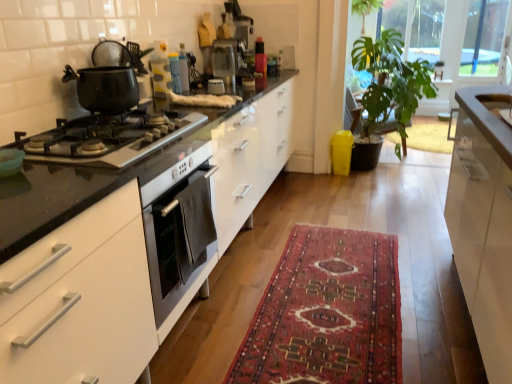
Question: Are white glossy cabinet at right and green leafy plant at upper right, the second window screen when ordered from right to left, beside each other?

Choices:
 (A) no
 (B) yes

Answer: (A)

Question: From a real-world perspective, is white glossy cabinet at right located beneath green leafy plant at upper right, the first window screen in the left-to-right sequence?

Choices:
 (A) yes
 (B) no

Answer: (A)

Question: Could you tell me if white glossy cabinet at right is turned towards green leafy plant at upper right, the first window screen in the left-to-right sequence?

Choices:
 (A) yes
 (B) no

Answer: (B)

Question: From the image's perspective, is white glossy cabinet at right on top of green leafy plant at upper right, the second window screen when ordered from right to left?

Choices:
 (A) yes
 (B) no

Answer: (B)

Question: Is white glossy cabinet at right facing away from green leafy plant at upper right, the first window screen in the left-to-right sequence?

Choices:
 (A) yes
 (B) no

Answer: (B)

Question: From the image's perspective, would you say white glossy cabinet at right is shown under green leafy plant at upper right, the first window screen in the left-to-right sequence?

Choices:
 (A) yes
 (B) no

Answer: (A)

Question: Considering the relative positions of white glossy sink at upper right and shiny black gas stove at left, the second gas stove when ordered from bottom to top, in the image provided, is white glossy sink at upper right to the left of shiny black gas stove at left, the second gas stove when ordered from bottom to top, from the viewer's perspective?

Choices:
 (A) yes
 (B) no

Answer: (B)

Question: From the image's perspective, is white glossy sink at upper right over shiny black gas stove at left, the second gas stove when ordered from bottom to top?

Choices:
 (A) yes
 (B) no

Answer: (A)

Question: Considering the relative positions of white glossy sink at upper right and shiny black gas stove at left, the 1th gas stove positioned from the top, in the image provided, is white glossy sink at upper right behind shiny black gas stove at left, the 1th gas stove positioned from the top,?

Choices:
 (A) no
 (B) yes

Answer: (B)

Question: Can you confirm if white glossy sink at upper right is wider than shiny black gas stove at left, the 1th gas stove positioned from the top?

Choices:
 (A) yes
 (B) no

Answer: (B)

Question: Can you confirm if white glossy sink at upper right is taller than shiny black gas stove at left, the second gas stove when ordered from bottom to top?

Choices:
 (A) yes
 (B) no

Answer: (A)

Question: Are white glossy sink at upper right and shiny black gas stove at left, the second gas stove when ordered from bottom to top, located far from each other?

Choices:
 (A) no
 (B) yes

Answer: (B)

Question: Is shiny black gas stove at left, the 1th gas stove positioned from the top, beside matte plastic container at upper center, which is the second appliance in right-to-left order?

Choices:
 (A) yes
 (B) no

Answer: (B)